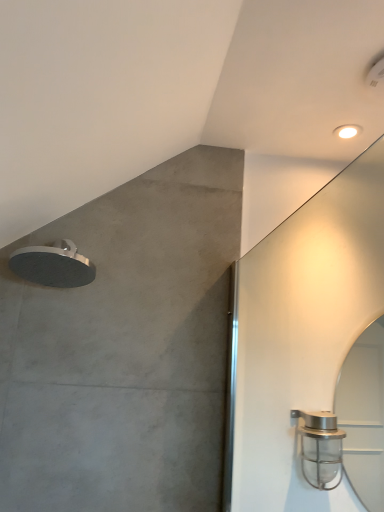
Question: Does satin nickel shower head at right, which is the second shower from top to bottom, have a lesser width compared to white glossy droplight at upper right?

Choices:
 (A) yes
 (B) no

Answer: (B)

Question: Does satin nickel shower head at right, the 1th shower positioned from the bottom, have a greater height compared to white glossy droplight at upper right?

Choices:
 (A) no
 (B) yes

Answer: (B)

Question: Is satin nickel shower head at right, the 1th shower positioned from the bottom, far away from white glossy droplight at upper right?

Choices:
 (A) no
 (B) yes

Answer: (A)

Question: Can you confirm if satin nickel shower head at right, the 1th shower positioned from the bottom, is bigger than white glossy droplight at upper right?

Choices:
 (A) yes
 (B) no

Answer: (A)

Question: From the image's perspective, is satin nickel shower head at right, the second shower when ordered from left to right, over white glossy droplight at upper right?

Choices:
 (A) yes
 (B) no

Answer: (B)

Question: Is satin nickel shower head at right, the 1th shower positioned from the bottom, shorter than white glossy droplight at upper right?

Choices:
 (A) yes
 (B) no

Answer: (B)

Question: From the image's perspective, is white glossy droplight at upper right under satin nickel shower head at right, which is the 1th shower in right-to-left order?

Choices:
 (A) yes
 (B) no

Answer: (B)

Question: Is white glossy droplight at upper right looking in the opposite direction of satin nickel shower head at right, the 1th shower positioned from the bottom?

Choices:
 (A) no
 (B) yes

Answer: (A)

Question: Is the depth of white glossy droplight at upper right greater than that of satin nickel shower head at right, the 1th shower positioned from the bottom?

Choices:
 (A) no
 (B) yes

Answer: (B)

Question: Does white glossy droplight at upper right have a greater height compared to satin nickel shower head at right, the 1th shower positioned from the bottom?

Choices:
 (A) yes
 (B) no

Answer: (B)

Question: Is satin nickel shower head at right, the second shower when ordered from left to right, a part of white glossy droplight at upper right?

Choices:
 (A) no
 (B) yes

Answer: (A)

Question: Can you confirm if white glossy droplight at upper right is smaller than satin nickel shower head at right, the second shower when ordered from left to right?

Choices:
 (A) yes
 (B) no

Answer: (A)

Question: Is satin silver showerhead at upper left, which is the second shower from right to left, positioned with its back to satin nickel shower head at right, which is the 1th shower in right-to-left order?

Choices:
 (A) no
 (B) yes

Answer: (A)